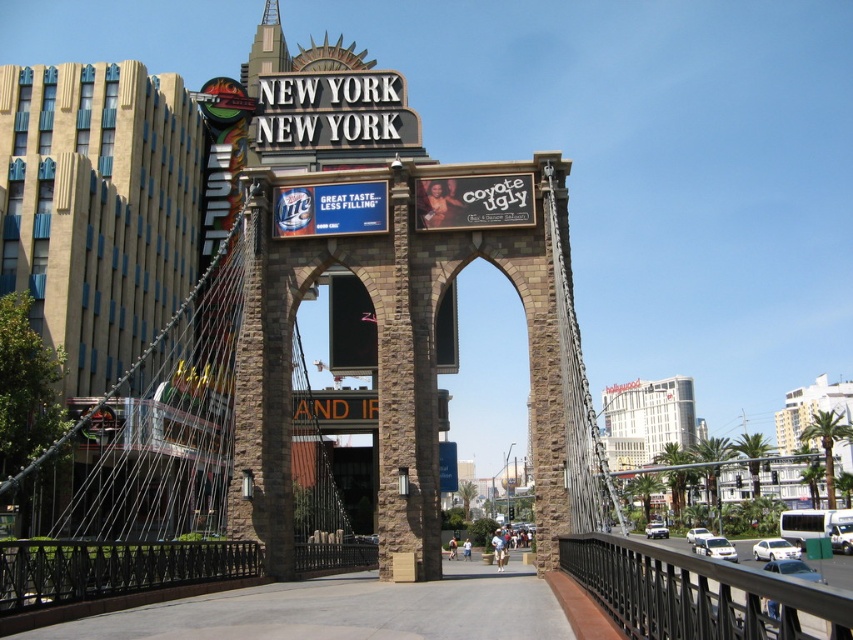
Can you confirm if metallic silver sign at upper center is positioned to the left of white glossy car at center?

Correct, you'll find metallic silver sign at upper center to the left of white glossy car at center.

Describe the element at coordinates (329, 209) in the screenshot. I see `metallic silver sign at upper center` at that location.

Which is in front, point (363, 230) or point (701, 529)?

Positioned in front is point (363, 230).

Where is `metallic silver sign at upper center`? The image size is (853, 640). metallic silver sign at upper center is located at coordinates (329, 209).

Which is behind, point (780, 547) or point (689, 531)?

The point (689, 531) is more distant.

Locate an element on the screen. white glossy sedan at lower right is located at coordinates (775, 548).

What do you see at coordinates (474, 202) in the screenshot?
I see `matte black sign at upper center` at bounding box center [474, 202].

Between matte black sign at upper center and green plastic street sign at lower right, which one appears on the right side from the viewer's perspective?

green plastic street sign at lower right is more to the right.

Does point (469, 221) come closer to viewer compared to point (811, 541)?

Yes, point (469, 221) is closer to viewer.

At what (x,y) coordinates should I click in order to perform the action: click on matte black sign at upper center. Please return your answer as a coordinate pair (x, y). Looking at the image, I should click on (474, 202).